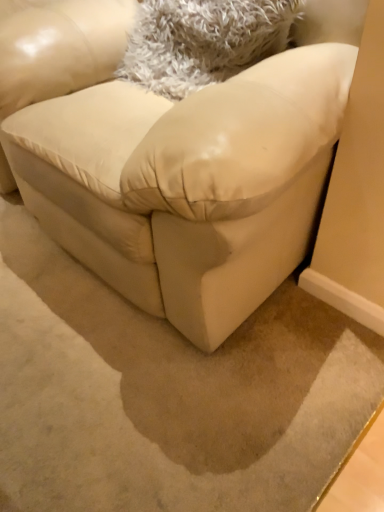
Where is `matte cream couch at center`? The width and height of the screenshot is (384, 512). matte cream couch at center is located at coordinates (171, 167).

What do you see at coordinates (171, 167) in the screenshot? I see `matte cream couch at center` at bounding box center [171, 167].

This screenshot has height=512, width=384. I want to click on white fluffy pillow at upper center, so click(203, 41).

Describe the element at coordinates (203, 41) in the screenshot. The height and width of the screenshot is (512, 384). I see `white fluffy pillow at upper center` at that location.

Identify the location of matte cream couch at center. (171, 167).

Between white fluffy pillow at upper center and matte cream couch at center, which one appears on the right side from the viewer's perspective?

white fluffy pillow at upper center is more to the right.

Is white fluffy pillow at upper center behind matte cream couch at center?

That is True.

Does point (185, 85) come behind point (148, 307)?

No, it is in front of (148, 307).

From the image's perspective, would you say white fluffy pillow at upper center is shown under matte cream couch at center?

No.

From a real-world perspective, which is physically above, white fluffy pillow at upper center or matte cream couch at center?

white fluffy pillow at upper center is physically above.

Which of these two, white fluffy pillow at upper center or matte cream couch at center, is wider?

matte cream couch at center.

Is white fluffy pillow at upper center taller or shorter than matte cream couch at center?

Considering their sizes, white fluffy pillow at upper center has less height than matte cream couch at center.

Considering the relative sizes of white fluffy pillow at upper center and matte cream couch at center in the image provided, is white fluffy pillow at upper center smaller than matte cream couch at center?

Indeed, white fluffy pillow at upper center has a smaller size compared to matte cream couch at center.

Looking at this image, is white fluffy pillow at upper center not within matte cream couch at center?

Actually, white fluffy pillow at upper center is within matte cream couch at center.

Are white fluffy pillow at upper center and matte cream couch at center making contact?

white fluffy pillow at upper center is not next to matte cream couch at center, and they're not touching.

Could you tell me if white fluffy pillow at upper center is turned towards matte cream couch at center?

Yes, white fluffy pillow at upper center is oriented towards matte cream couch at center.

You are a GUI agent. You are given a task and a screenshot of the screen. Output one action in this format:
    pyautogui.click(x=<x>, y=<y>)
    Task: Click on the studio couch that is below the white fluffy pillow at upper center (from the image's perspective)
    
    Given the screenshot: What is the action you would take?
    pyautogui.click(x=171, y=167)

Would you say matte cream couch at center is to the left or to the right of white fluffy pillow at upper center in the picture?

Based on their positions, matte cream couch at center is located to the left of white fluffy pillow at upper center.

Which is in front, matte cream couch at center or white fluffy pillow at upper center?

matte cream couch at center is in front.

Is point (254, 83) behind point (234, 69)?

No, (254, 83) is in front of (234, 69).

From the image's perspective, does matte cream couch at center appear higher than white fluffy pillow at upper center?

Incorrect, from the image's perspective, matte cream couch at center is lower than white fluffy pillow at upper center.

From a real-world perspective, which is physically above, matte cream couch at center or white fluffy pillow at upper center?

white fluffy pillow at upper center is physically above.

Does matte cream couch at center have a greater width compared to white fluffy pillow at upper center?

Indeed, matte cream couch at center has a greater width compared to white fluffy pillow at upper center.

Does matte cream couch at center have a lesser height compared to white fluffy pillow at upper center?

Incorrect, the height of matte cream couch at center does not fall short of that of white fluffy pillow at upper center.

Is matte cream couch at center bigger or smaller than white fluffy pillow at upper center?

In the image, matte cream couch at center appears to be larger than white fluffy pillow at upper center.

Is white fluffy pillow at upper center located within matte cream couch at center?

Yes, matte cream couch at center is surrounding white fluffy pillow at upper center.

Are matte cream couch at center and white fluffy pillow at upper center located far from each other?

They are positioned close to each other.

Is matte cream couch at center facing away from white fluffy pillow at upper center?

Absolutely, matte cream couch at center is directed away from white fluffy pillow at upper center.

Consider the image. How different are the orientations of matte cream couch at center and white fluffy pillow at upper center in degrees?

The facing directions of matte cream couch at center and white fluffy pillow at upper center are 10.6 degrees apart.

Measure the distance from matte cream couch at center to white fluffy pillow at upper center.

A distance of 10.88 inches exists between matte cream couch at center and white fluffy pillow at upper center.

The width and height of the screenshot is (384, 512). In order to click on throw pillow on the right of matte cream couch at center in this screenshot , I will do `click(203, 41)`.

This screenshot has height=512, width=384. I want to click on studio couch on the left of white fluffy pillow at upper center, so pyautogui.click(x=171, y=167).

Find the location of `throw pillow behind the matte cream couch at center`. throw pillow behind the matte cream couch at center is located at coordinates (203, 41).